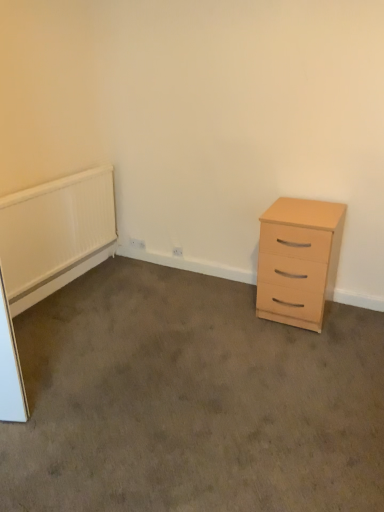
I want to click on vacant area on top of light wood drawer at right (from a real-world perspective), so click(142, 373).